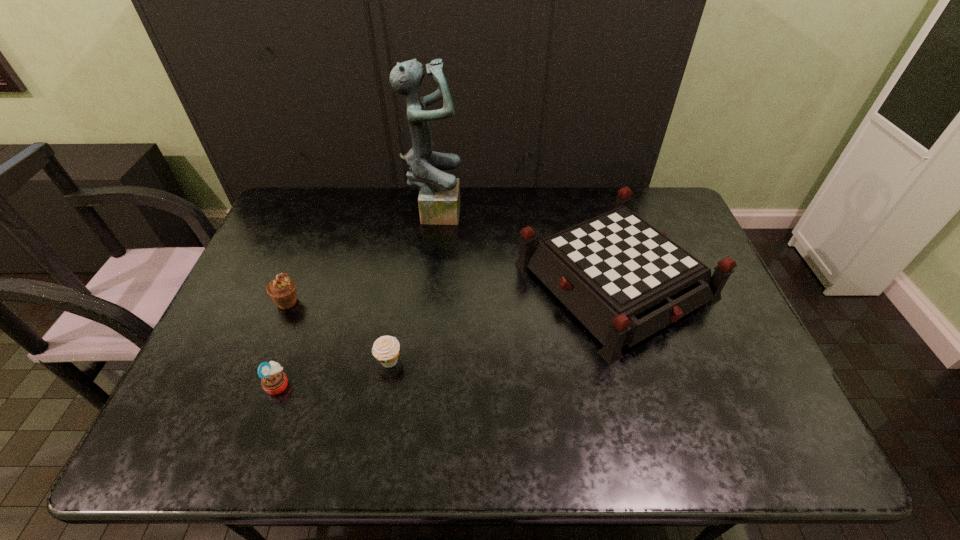
At what (x,y) coordinates should I click in order to perform the action: click on the tallest object. Please return your answer as a coordinate pair (x, y). This screenshot has width=960, height=540. Looking at the image, I should click on (439, 198).

This screenshot has width=960, height=540. Identify the location of the second tallest object. (624, 280).

Locate an element on the screen. The width and height of the screenshot is (960, 540). the rightmost object is located at coordinates (624, 280).

At what (x,y) coordinates should I click in order to perform the action: click on the farthest muffin. Please return your answer as a coordinate pair (x, y). Looking at the image, I should click on (282, 290).

Find the location of a particular element. This screenshot has width=960, height=540. the second farthest muffin is located at coordinates (386, 349).

Where is `the nearest muffin`? The height and width of the screenshot is (540, 960). the nearest muffin is located at coordinates (274, 381).

Locate an element on the screen. The height and width of the screenshot is (540, 960). vacant space situated on the face of the tallest object is located at coordinates (511, 210).

The height and width of the screenshot is (540, 960). Find the location of `vacant region located 0.120m on the back of the fourth shortest object`. vacant region located 0.120m on the back of the fourth shortest object is located at coordinates (589, 198).

Image resolution: width=960 pixels, height=540 pixels. In order to click on vacant space located 0.400m on the right of the farthest muffin in this screenshot , I will do `click(444, 301)`.

Image resolution: width=960 pixels, height=540 pixels. In order to click on vacant position located on the back of the rightmost muffin in this screenshot , I will do `click(407, 254)`.